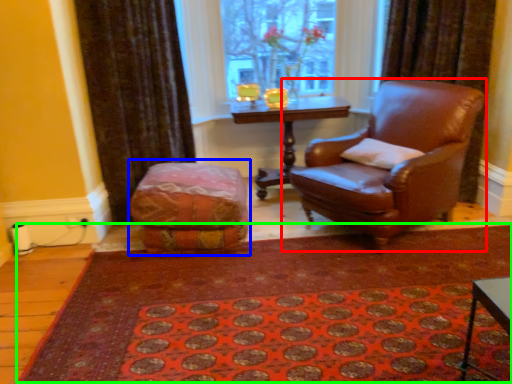
Question: Which object is the farthest from chair (highlighted by a red box)? Choose among these: bean bag chair (highlighted by a blue box) or doormat (highlighted by a green box).

Choices:
 (A) bean bag chair
 (B) doormat

Answer: (A)